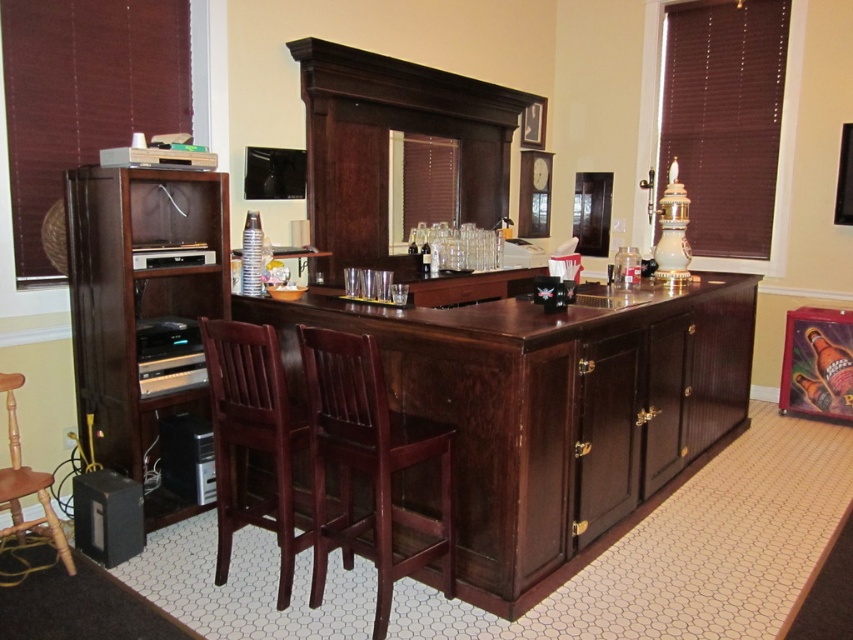
Question: Which object appears closest to the camera in this image?

Choices:
 (A) light brown wood bar stool at lower left
 (B) mahogany wood chair at center
 (C) metallic gold beer bottle at center

Answer: (B)

Question: Which of the following is the farthest from the observer?

Choices:
 (A) brown wood chair at center
 (B) dark wood bar at center
 (C) light brown wood bar stool at lower left
 (D) metallic gold beer bottle at center

Answer: (D)

Question: Observing the image, what is the correct spatial positioning of brown wood chair at center in reference to metallic gold beer bottle at center?

Choices:
 (A) left
 (B) right

Answer: (A)

Question: Which of the following is the farthest from the observer?

Choices:
 (A) dark wood counter top at center
 (B) brown wood chair at center
 (C) light brown wood bar stool at lower left

Answer: (C)

Question: Does brown wood chair at center appear on the right side of dark wood drawer at center?

Choices:
 (A) no
 (B) yes

Answer: (A)

Question: Does dark wood drawer at center appear under metallic gold beer bottle at center?

Choices:
 (A) no
 (B) yes

Answer: (A)